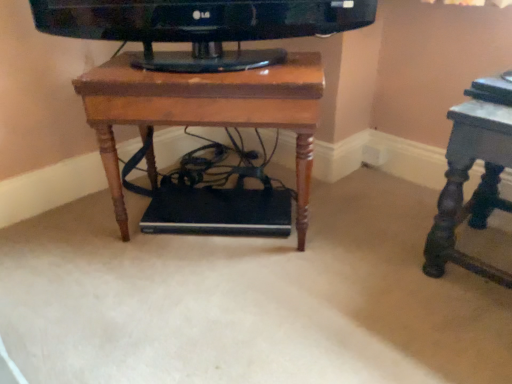
Identify the location of vacant space behind dark gray polished wood table at right, positioned as the first table in right-to-left order. Image resolution: width=512 pixels, height=384 pixels. (402, 203).